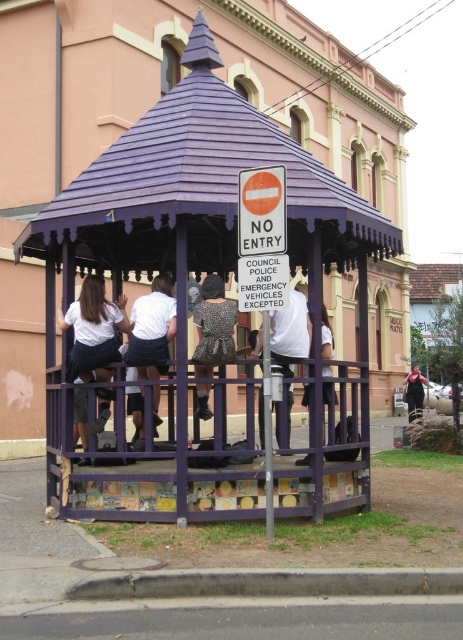
You are standing in front of the gazebo and want to take a photo of both the NO ENTRY sign and the gazebo. You notice two points marked as point 1 at coordinates point (50,410) and point 2 at coordinates point (306,404). Which point should you focus on to ensure both the NO ENTRY sign and the gazebo are in your frame?

Point 1 at coordinates point (50,410) is further to the camera than point 2 at coordinates point (306,404). To include both the NO ENTRY sign and the gazebo in your photo, you should focus on point 1 at coordinates point (50,410) because it is closer to you, allowing both objects to be in the same frame.

In the scene shown: You are a delivery person trying to determine if your 1.8 meter wide delivery cart can fit through the space between the purple painted wood gazebo at center and the white fabric shirt at center. Based on their sizes, can your cart pass through?

Answer: The purple painted wood gazebo at center is larger in size than the white fabric shirt at center, but the exact dimensions of the space between them are not provided. Therefore, it is uncertain if the 1.8 meter wide delivery cart can pass through.

You are a photographer positioned at the gazebo entrance. You notice two people inside wearing a white cotton shirt at center and a printed fabric dress at center. Which clothing item is closer to your camera?

The white cotton shirt at center is closer to the camera because it is further to the viewer than the printed fabric dress at center.